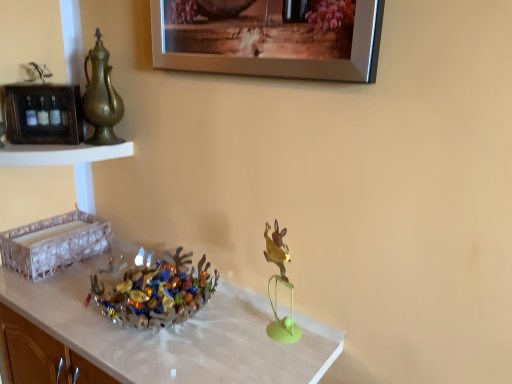
Where is `vacant region in front of translucent glass bowl at center`? The width and height of the screenshot is (512, 384). vacant region in front of translucent glass bowl at center is located at coordinates (154, 354).